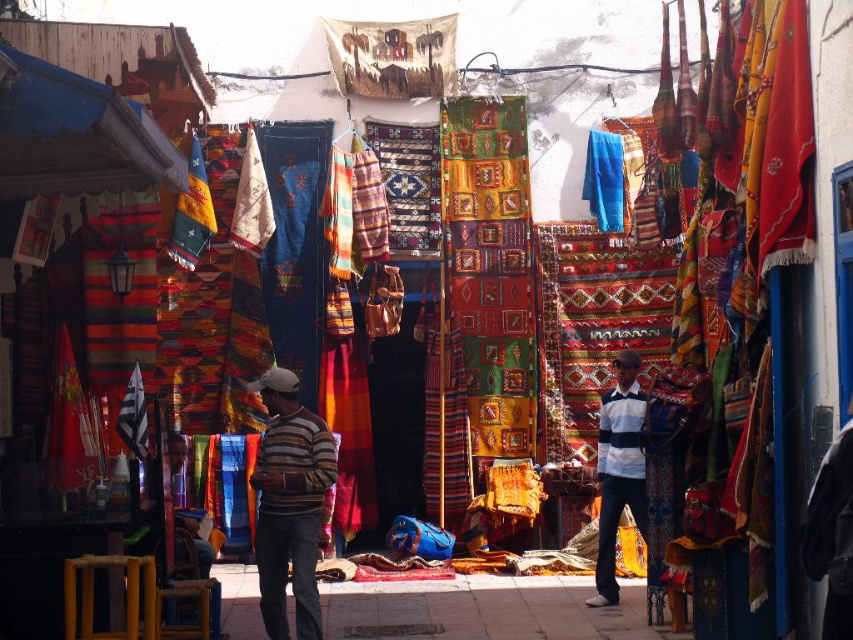
You are a delivery person carrying a large box that measures 3 meters in length. You need to navigate through the market stall where the striped cotton sweater at center and white striped shirt at center are displayed. Can you pass between these two items without tilting the box?

The distance between the striped cotton sweater at center and the white striped shirt at center is 3.40 meters, which is wider than the 3 meter length of the box. Therefore, you can pass between them without tilting the box.

You are a customer at the market and want to buy both the striped cotton sweater at center and the white striped shirt at center. If you first pick up the item on the left, which one will you choose?

The striped cotton sweater at center is to the left of the white striped shirt at center, so you will first pick up the striped cotton sweater at center.

You are a customer at the market and want to buy a garment that is shorter in height. Which one between the striped cotton sweater at center and the white striped shirt at center should you choose?

The striped cotton sweater at center has a lesser height compared to the white striped shirt at center, so you should choose the striped cotton sweater at center.